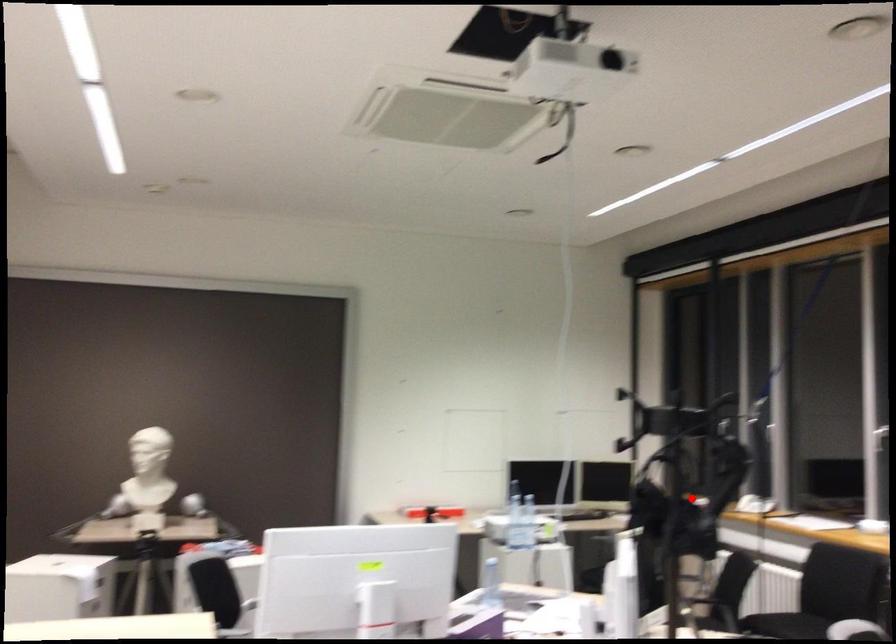
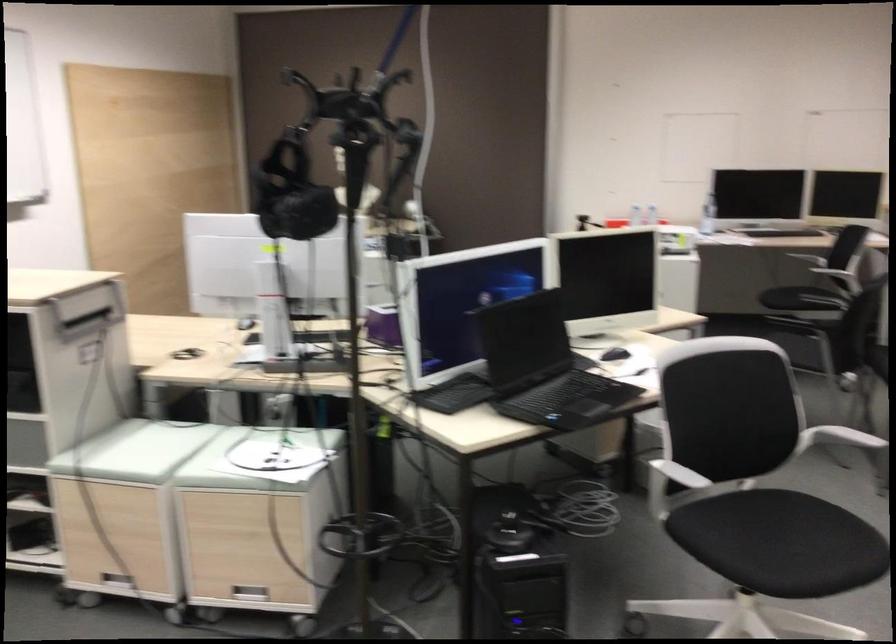
Where in the second image is the point corresponding to the highlighted location from the first image?

(291, 192)